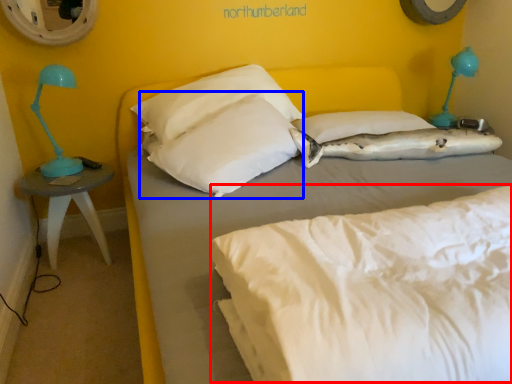
Question: Which of the following is the farthest to the observer, mattress (highlighted by a red box) or pillow (highlighted by a blue box)?

Choices:
 (A) mattress
 (B) pillow

Answer: (B)